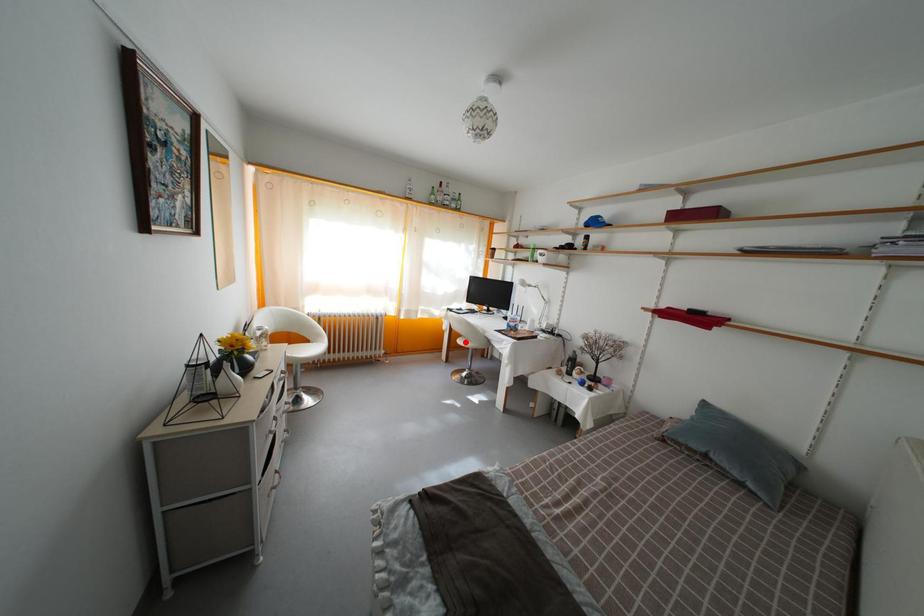
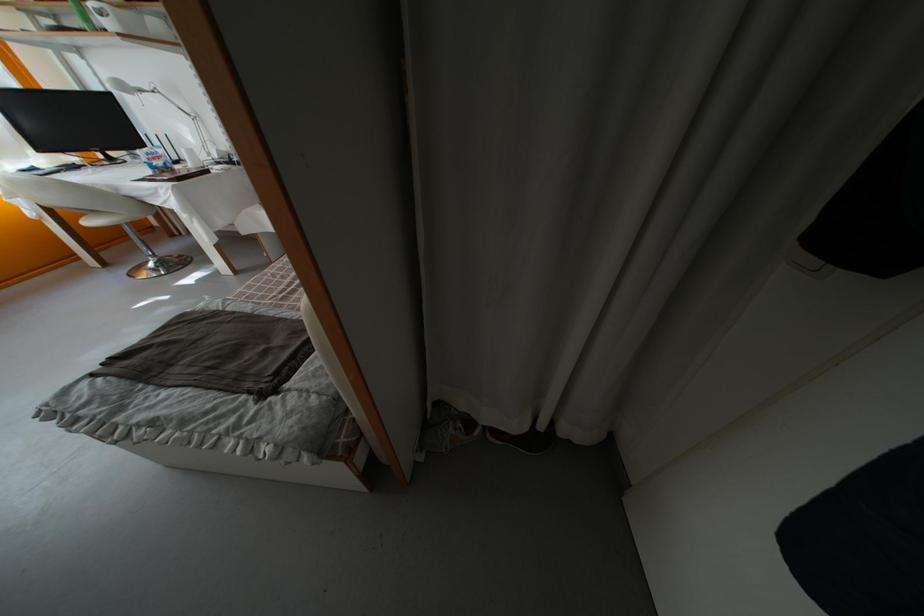
In the second image, find the point that corresponds to the highlighted location in the first image.

(84, 221)